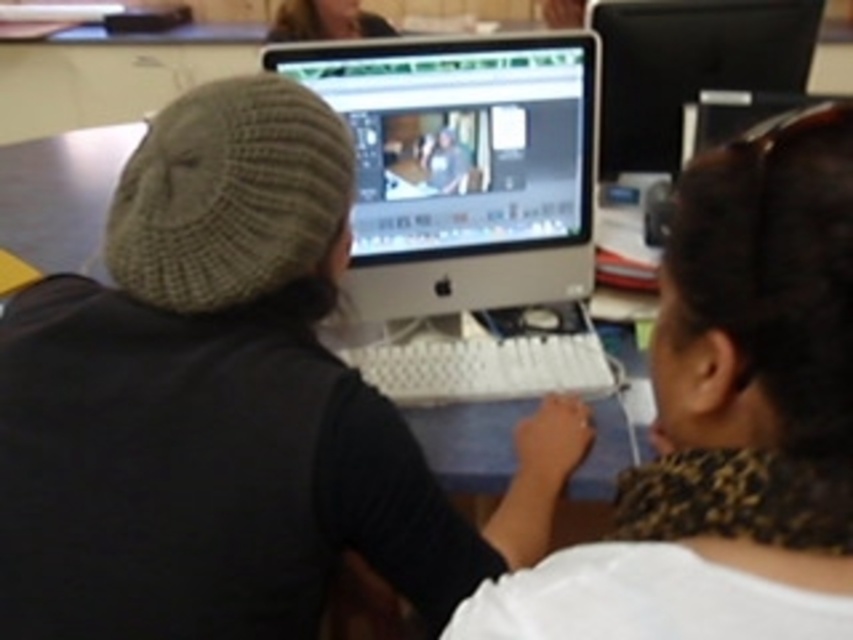
You are a photographer setting up a shoot in this scene. You need to place a small prop exactly at the point marked as point (x=729, y=419). What object is located at that point?

The white textured sweater at center is located at point (x=729, y=419).

Based on the scene described, where is the satin white monitor at center in relation to the smooth skin face at upper center?

The satin white monitor at center is to the right of the smooth skin face at upper center.

You are a photographer standing at the edge of the desk. You see the point at coordinates (729, 419) and the white textured sweater at center. Which object is closer to the edge of the desk?

The white textured sweater at center is located at the point (729, 419), so they are the same location. Therefore, neither is closer because they are at the same spot.